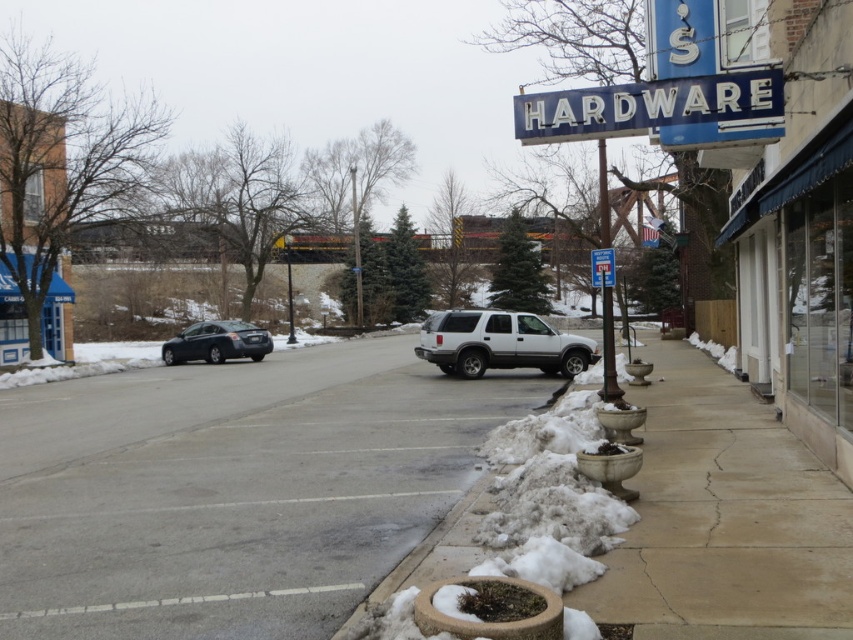
Does gray asphalt pavement at center come in front of blue metallic sign at upper center?

Yes, gray asphalt pavement at center is closer to the viewer.

Who is more forward, [230,440] or [708,93]?

Point [708,93] is in front.

You are a GUI agent. You are given a task and a screenshot of the screen. Output one action in this format:
    pyautogui.click(x=<x>, y=<y>)
    Task: Click on the gray asphalt pavement at center
    The height and width of the screenshot is (640, 853).
    Given the screenshot: What is the action you would take?
    pyautogui.click(x=231, y=490)

Locate an element on the screen. This screenshot has width=853, height=640. gray asphalt pavement at center is located at coordinates [231, 490].

The image size is (853, 640). Find the location of `silver metallic suv at center`. silver metallic suv at center is located at coordinates (500, 342).

Which is behind, point (457, 326) or point (209, 324)?

Point (209, 324)

Where is `silver metallic suv at center`? This screenshot has width=853, height=640. silver metallic suv at center is located at coordinates (500, 342).

Can you confirm if blue metallic sign at upper center is bigger than satin black sedan at center-left?

Actually, blue metallic sign at upper center might be smaller than satin black sedan at center-left.

From the picture: Does blue metallic sign at upper center appear on the left side of satin black sedan at center-left?

No, blue metallic sign at upper center is not to the left of satin black sedan at center-left.

Identify the location of blue metallic sign at upper center. This screenshot has width=853, height=640. pyautogui.click(x=656, y=108).